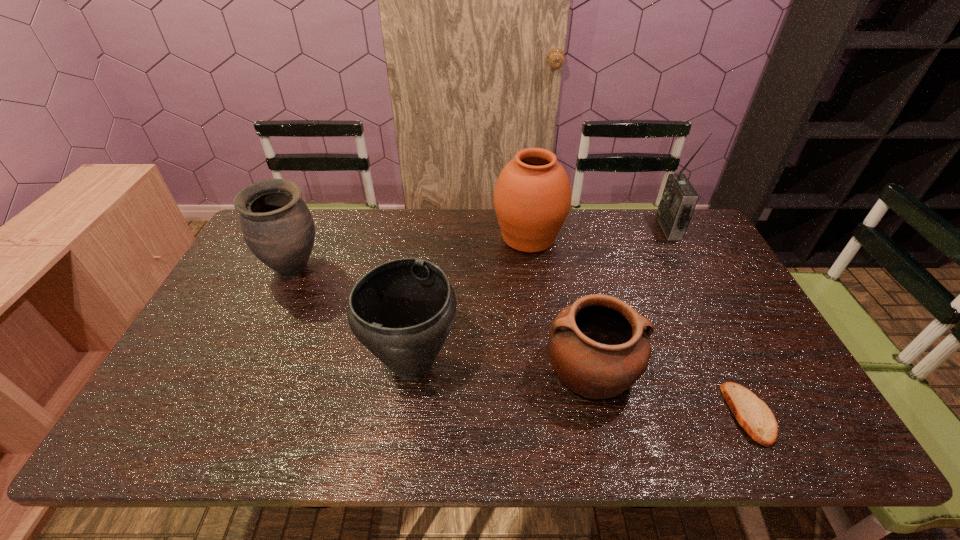
Locate an element on the screen. radio receiver is located at coordinates (679, 198).

The width and height of the screenshot is (960, 540). In order to click on the rightmost urn in this screenshot , I will do `click(532, 197)`.

The width and height of the screenshot is (960, 540). Find the location of `the leftmost urn`. the leftmost urn is located at coordinates (277, 226).

Locate an element on the screen. The width and height of the screenshot is (960, 540). the second urn from right to left is located at coordinates (402, 311).

Where is `the fifth object from right to left`? the fifth object from right to left is located at coordinates (402, 311).

Identify the location of the fifth tallest object. (598, 346).

Where is `pita bread`? The width and height of the screenshot is (960, 540). pita bread is located at coordinates (754, 416).

Find the location of `vacant space located 0.310m on the display of the radio receiver`. vacant space located 0.310m on the display of the radio receiver is located at coordinates (572, 228).

The width and height of the screenshot is (960, 540). Identify the location of free space located on the display of the radio receiver. (546, 228).

Where is `vacant space located on the display of the radio receiver`? This screenshot has height=540, width=960. vacant space located on the display of the radio receiver is located at coordinates (592, 228).